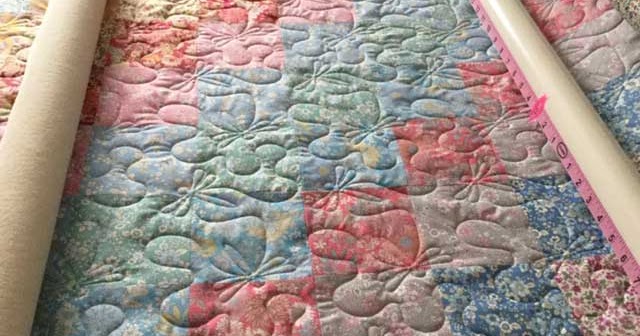
Identify the location of cream colored cylinder on the right side of quilt. Image resolution: width=640 pixels, height=336 pixels. pos(589,141).